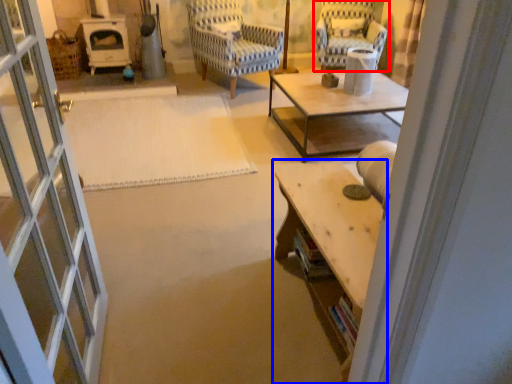
Question: Which of the following is the farthest to the observer, chair (highlighted by a red box) or table (highlighted by a blue box)?

Choices:
 (A) chair
 (B) table

Answer: (A)